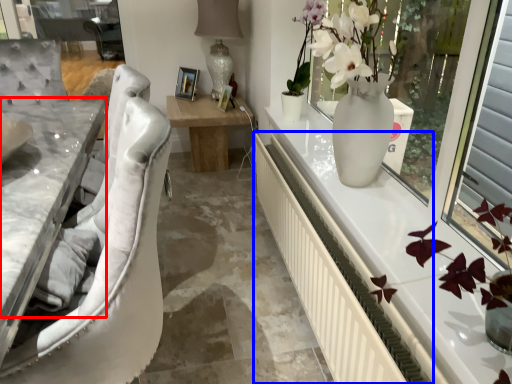
Question: Which object is further to the camera taking this photo, counter top (highlighted by a red box) or radiator (highlighted by a blue box)?

Choices:
 (A) counter top
 (B) radiator

Answer: (B)